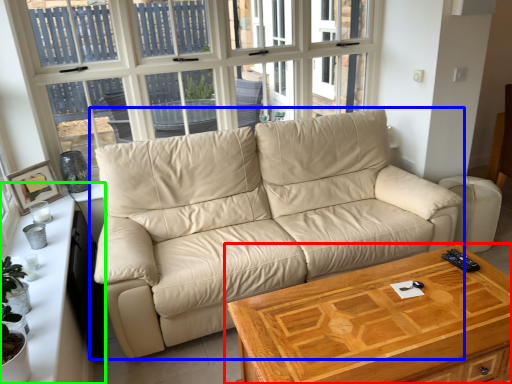
Question: Which object is positioned closest to table (highlighted by a red box)? Select from studio couch (highlighted by a blue box) and dresser (highlighted by a green box).

Choices:
 (A) studio couch
 (B) dresser

Answer: (A)